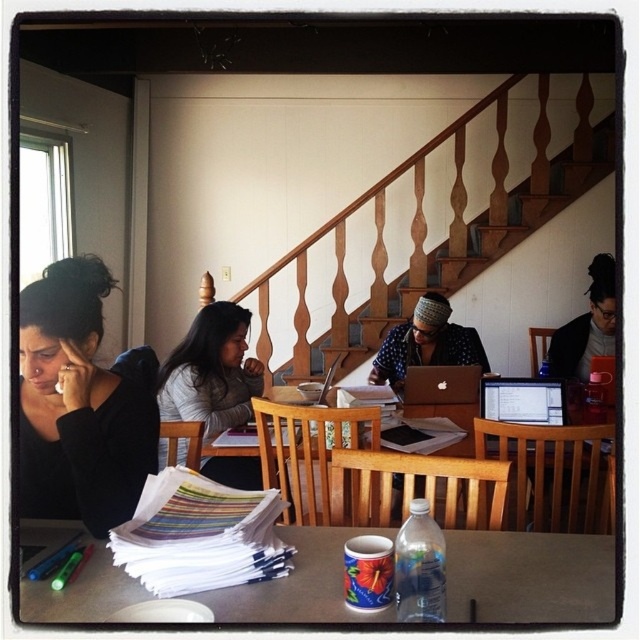
You are a person who wants to place a book on the smooth brown table at lower center. However, you notice the polka dot shirt at center is blocking the table. Can you still place the book on the table without moving the shirt?

The smooth brown table at lower center is not as tall as the polka dot shirt at center, which means the shirt is taller than the table. Therefore, the shirt might be hanging over the table, blocking it. To place the book, you might need to adjust the shirt or find an unobstructed area of the table.

You are a guest at this dinner and want to place your phone on the wooden table at center without it being under the polka dot shirt at center. Is this possible?

Yes, since the wooden table at center is located below the polka dot shirt at center, there is space on the table outside the area directly under the shirt to place the phone.

You are sitting at the smooth brown table at lower center and want to hand a pen to the person wearing the polka dot shirt at center. Can you reach them without moving from your seat?

The smooth brown table at lower center is closer to the viewer than the polka dot shirt at center, so you are sitting closer to the viewer than the person wearing the polka dot shirt at center. Therefore, you might need to stretch your arm to reach them, but it depends on the distance between the table and the person.